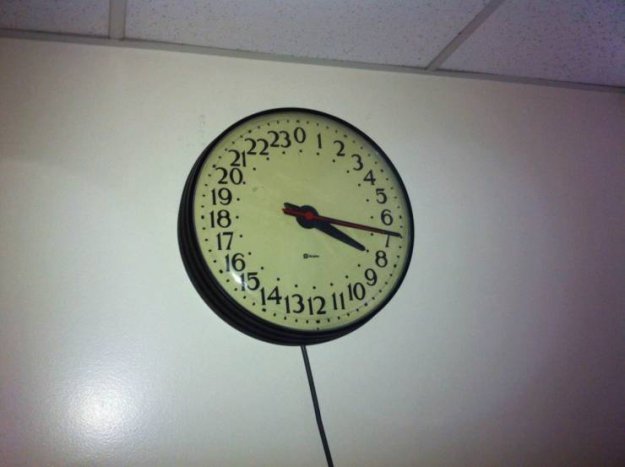
Image resolution: width=625 pixels, height=467 pixels. In order to click on clock in this screenshot , I will do tap(292, 191).